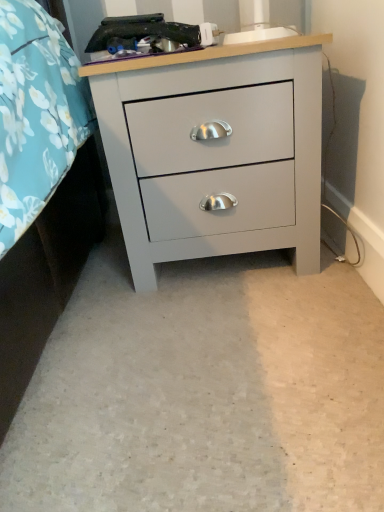
At what (x,y) coordinates should I click in order to perform the action: click on matte gray cabinet at center. Please return your answer as a coordinate pair (x, y). This screenshot has height=512, width=384. Looking at the image, I should click on pos(215,151).

What do you see at coordinates (215, 151) in the screenshot?
I see `matte gray cabinet at center` at bounding box center [215, 151].

You are a GUI agent. You are given a task and a screenshot of the screen. Output one action in this format:
    pyautogui.click(x=<x>, y=<y>)
    Task: Click on the matte gray cabinet at center
    The height and width of the screenshot is (512, 384).
    Given the screenshot: What is the action you would take?
    pyautogui.click(x=215, y=151)